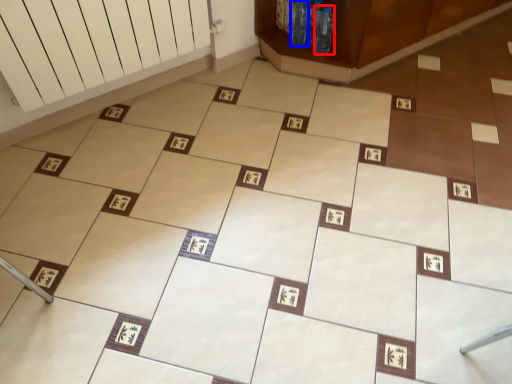
Question: Which object appears farthest to the camera in this image, bottle (highlighted by a red box) or bottle (highlighted by a blue box)?

Choices:
 (A) bottle
 (B) bottle

Answer: (B)